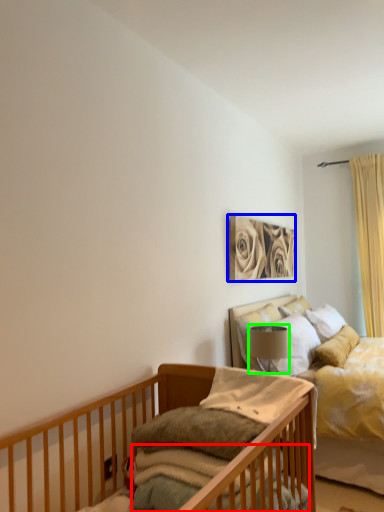
Question: Based on their relative distances, which object is farther from mattress (highlighted by a red box)? Choose from picture frame (highlighted by a blue box) and lamp (highlighted by a green box).

Choices:
 (A) picture frame
 (B) lamp

Answer: (A)